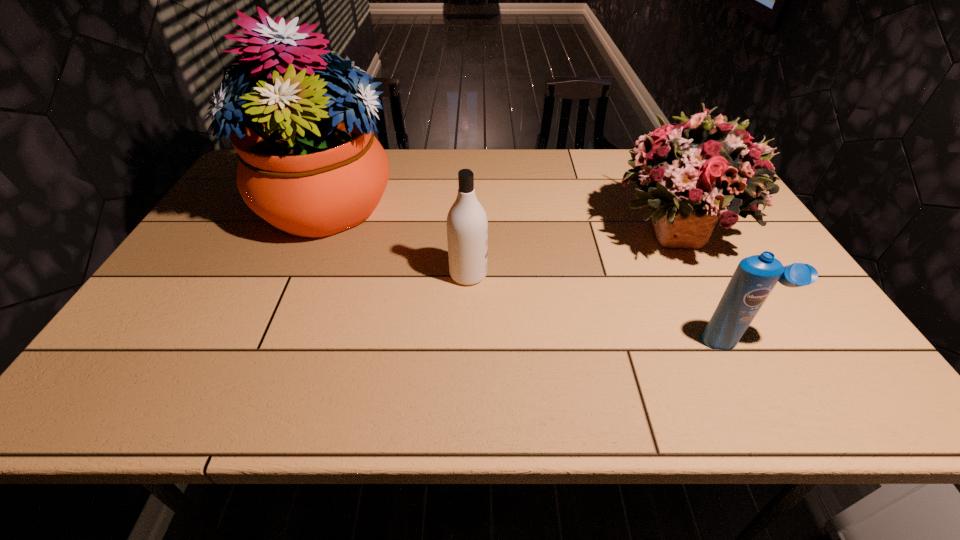
Where is `flower arrangement`? flower arrangement is located at coordinates pos(310,165).

Locate an element on the screen. Image resolution: width=960 pixels, height=540 pixels. the tallest object is located at coordinates (310, 165).

I want to click on bouquet, so click(692, 172).

Identify the location of the left shampoo. The height and width of the screenshot is (540, 960). (467, 225).

You are a GUI agent. You are given a task and a screenshot of the screen. Output one action in this format:
    pyautogui.click(x=<x>, y=<y>)
    Task: Click on the farther shampoo
    
    Given the screenshot: What is the action you would take?
    pyautogui.click(x=467, y=225)

Identify the location of the shorter shampoo. The image size is (960, 540). (755, 277).

Where is `the shortest object`? This screenshot has width=960, height=540. the shortest object is located at coordinates (755, 277).

In order to click on vacant space located on the left of the tallest object in this screenshot , I will do `click(237, 205)`.

Locate an element on the screen. The width and height of the screenshot is (960, 540). vacant region located 0.050m on the back of the bouquet is located at coordinates (648, 182).

I want to click on vacant space located on the front-facing side of the left shampoo, so click(570, 274).